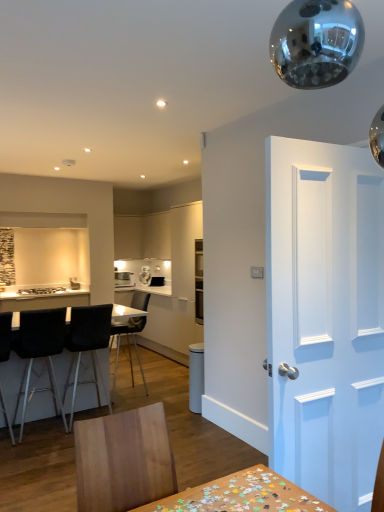
This screenshot has height=512, width=384. Describe the element at coordinates (145, 275) in the screenshot. I see `satin black toaster at center, which is counted as the 2th appliance, starting from the left` at that location.

The width and height of the screenshot is (384, 512). In order to click on white matte door at right in this screenshot , I will do `click(325, 317)`.

How much space does matte white cabinet at center, which is counted as the 1th cabinetry, starting from the left, occupy vertically?

The height of matte white cabinet at center, which is counted as the 1th cabinetry, starting from the left, is 79.75 centimeters.

What do you see at coordinates (128, 237) in the screenshot?
I see `matte white cabinet at center, which is counted as the 1th cabinetry, starting from the left` at bounding box center [128, 237].

Measure the distance between point (119, 280) and camera.

A distance of 6.86 meters exists between point (119, 280) and camera.

What is the approximate height of satin silver toaster at center, the second appliance in the right-to-left sequence?

satin silver toaster at center, the second appliance in the right-to-left sequence, is 9.98 inches in height.

The height and width of the screenshot is (512, 384). I want to click on white matte cabinet at center, which is counted as the first cabinetry, starting from the right, so click(156, 234).

Find the location of a particular element. The height and width of the screenshot is (512, 384). satin black toaster at center, which is counted as the 2th appliance, starting from the left is located at coordinates (145, 275).

From the image's perspective, which is above, satin black toaster at center, which is counted as the 2th appliance, starting from the left, or black leather chair at left, positioned as the 1th chair in front-to-back order?

satin black toaster at center, which is counted as the 2th appliance, starting from the left, from the image's perspective.

I want to click on the 3rd chair counting from the left of the satin black toaster at center, which is the 1th appliance from right to left, so click(5, 335).

Which object is wider, satin black toaster at center, which is the 1th appliance from right to left, or black leather chair at left, which is the 4th chair from back to front?

With larger width is black leather chair at left, which is the 4th chair from back to front.

Locate an element on the screen. the 2nd chair in front of the satin silver toaster at center, which is counted as the first appliance, starting from the left is located at coordinates (88, 345).

Who is more distant, black leather chair at left, acting as the second chair starting from the back, or satin silver toaster at center, the second appliance in the right-to-left sequence?

satin silver toaster at center, the second appliance in the right-to-left sequence.

Considering the relative positions of black leather chair at left, acting as the second chair starting from the back, and satin silver toaster at center, which is counted as the first appliance, starting from the left, in the image provided, is black leather chair at left, acting as the second chair starting from the back, to the left of satin silver toaster at center, which is counted as the first appliance, starting from the left, from the viewer's perspective?

No, black leather chair at left, acting as the second chair starting from the back, is not to the left of satin silver toaster at center, which is counted as the first appliance, starting from the left.

Is black fabric chair at left, the second chair in the front-to-back sequence, positioned with its back to white matte cabinet at center, which is counted as the first cabinetry, starting from the right?

That's not correct — black fabric chair at left, the second chair in the front-to-back sequence, is not looking away from white matte cabinet at center, which is counted as the first cabinetry, starting from the right.

From the picture: Considering the relative sizes of black fabric chair at left, the second chair in the front-to-back sequence, and white matte cabinet at center, marked as the second cabinetry in a left-to-right arrangement, in the image provided, is black fabric chair at left, the second chair in the front-to-back sequence, taller than white matte cabinet at center, marked as the second cabinetry in a left-to-right arrangement,?

Indeed, black fabric chair at left, the second chair in the front-to-back sequence, has a greater height compared to white matte cabinet at center, marked as the second cabinetry in a left-to-right arrangement.

From a real-world perspective, is black fabric chair at left, the second chair in the front-to-back sequence, positioned above or below white matte cabinet at center, marked as the second cabinetry in a left-to-right arrangement?

black fabric chair at left, the second chair in the front-to-back sequence, is situated lower than white matte cabinet at center, marked as the second cabinetry in a left-to-right arrangement, in the real world.

Which is more to the right, black fabric chair at left, acting as the 3th chair starting from the back, or white matte cabinet at center, marked as the second cabinetry in a left-to-right arrangement?

From the viewer's perspective, white matte cabinet at center, marked as the second cabinetry in a left-to-right arrangement, appears more on the right side.

From a real-world perspective, which object rests below the other?

In real-world perspective, black matte chair at center, which is the 1th chair from back to front, is lower.

Is there a large distance between black leather chair at left, positioned as the 1th chair in front-to-back order, and black matte chair at center, which is the 1th chair from back to front?

Yes, black leather chair at left, positioned as the 1th chair in front-to-back order, is far from black matte chair at center, which is the 1th chair from back to front.

Is black leather chair at left, which is the 4th chair from back to front, inside or outside of black matte chair at center, positioned as the fourth chair in front-to-back order?

black leather chair at left, which is the 4th chair from back to front, exists outside the volume of black matte chair at center, positioned as the fourth chair in front-to-back order.

Can you confirm if black leather chair at left, positioned as the 1th chair in front-to-back order, is bigger than black matte chair at center, positioned as the fourth chair in front-to-back order?

No.

Where is `cabinetry that is the 2nd object to the left of the white matte door at right, starting at the anchor`? The image size is (384, 512). cabinetry that is the 2nd object to the left of the white matte door at right, starting at the anchor is located at coordinates (128, 237).

From the image's perspective, between matte white cabinet at center, which is counted as the 1th cabinetry, starting from the left, and white matte door at right, which one is located above?

matte white cabinet at center, which is counted as the 1th cabinetry, starting from the left.

Considering the points (128, 253) and (297, 207), which point is behind, point (128, 253) or point (297, 207)?

Positioned behind is point (128, 253).

From a real-world perspective, which is physically above, white matte cabinet at center, which is counted as the first cabinetry, starting from the right, or matte white cabinet at center, the 2th cabinetry positioned from the right?

In real-world perspective, matte white cabinet at center, the 2th cabinetry positioned from the right, is above.

Is white matte cabinet at center, marked as the second cabinetry in a left-to-right arrangement, positioned far away from matte white cabinet at center, the 2th cabinetry positioned from the right?

They are positioned close to each other.

Based on the photo, considering the relative sizes of white matte cabinet at center, which is counted as the first cabinetry, starting from the right, and matte white cabinet at center, the 2th cabinetry positioned from the right, in the image provided, is white matte cabinet at center, which is counted as the first cabinetry, starting from the right, taller than matte white cabinet at center, the 2th cabinetry positioned from the right,?

Indeed, white matte cabinet at center, which is counted as the first cabinetry, starting from the right, has a greater height compared to matte white cabinet at center, the 2th cabinetry positioned from the right.

Is satin silver toaster at center, the second appliance in the right-to-left sequence, completely or partially outside of black leather chair at left, acting as the second chair starting from the back?

Indeed, satin silver toaster at center, the second appliance in the right-to-left sequence, is completely outside black leather chair at left, acting as the second chair starting from the back.

Can you confirm if satin silver toaster at center, the second appliance in the right-to-left sequence, is bigger than black leather chair at left, acting as the second chair starting from the back?

Actually, satin silver toaster at center, the second appliance in the right-to-left sequence, might be smaller than black leather chair at left, acting as the second chair starting from the back.

Between satin silver toaster at center, the second appliance in the right-to-left sequence, and black leather chair at left, acting as the second chair starting from the back, which one has more height?

black leather chair at left, acting as the second chair starting from the back, is taller.

Between satin silver toaster at center, the second appliance in the right-to-left sequence, and black leather chair at left, acting as the second chair starting from the back, which one is positioned behind?

satin silver toaster at center, the second appliance in the right-to-left sequence.

Locate an element on the screen. This screenshot has width=384, height=512. the 2nd appliance behind the black leather chair at left, which is the 4th chair from back to front, starting your count from the anchor is located at coordinates (145, 275).

Locate an element on the screen. This screenshot has height=512, width=384. appliance on the left of black leather chair at left, the 3th chair viewed from the front is located at coordinates (123, 279).

Which object lies nearer to the anchor point matte white cabinet at center, the 2th cabinetry positioned from the right, black fabric chair at left, the second chair in the front-to-back sequence, or satin black toaster at center, which is counted as the 2th appliance, starting from the left?

satin black toaster at center, which is counted as the 2th appliance, starting from the left.

Looking at the image, which one is located closer to white matte door at right, black leather chair at left, the 3th chair viewed from the front, or black leather chair at left, positioned as the 1th chair in front-to-back order?

black leather chair at left, the 3th chair viewed from the front, is positioned closer to the anchor white matte door at right.

Estimate the real-world distances between objects in this image. Which object is closer to matte white cabinet at center, which is counted as the 1th cabinetry, starting from the left, white matte door at right or black fabric chair at left, acting as the 3th chair starting from the back?

black fabric chair at left, acting as the 3th chair starting from the back, is positioned closer to the anchor matte white cabinet at center, which is counted as the 1th cabinetry, starting from the left.

When comparing their distances from black leather table at left, does white matte cabinet at center, marked as the second cabinetry in a left-to-right arrangement, or satin black toaster at center, which is counted as the 2th appliance, starting from the left, seem further?

white matte cabinet at center, marked as the second cabinetry in a left-to-right arrangement, lies further to black leather table at left than the other object.

Looking at the image, which one is located closer to white matte door at right, black leather chair at left, acting as the second chair starting from the back, or black leather table at left?

Among the two, black leather chair at left, acting as the second chair starting from the back, is located nearer to white matte door at right.

Which object lies nearer to the anchor point satin silver toaster at center, which is counted as the first appliance, starting from the left, black fabric chair at left, acting as the 3th chair starting from the back, or black leather table at left?

The object closer to satin silver toaster at center, which is counted as the first appliance, starting from the left, is black leather table at left.

Considering their positions, is satin silver toaster at center, the second appliance in the right-to-left sequence, positioned further to white matte cabinet at center, marked as the second cabinetry in a left-to-right arrangement, than white matte door at right?

Among the two, white matte door at right is located further to white matte cabinet at center, marked as the second cabinetry in a left-to-right arrangement.

When comparing their distances from black fabric chair at left, acting as the 3th chair starting from the back, does black leather table at left or white matte cabinet at center, which is counted as the first cabinetry, starting from the right, seem further?

Among the two, white matte cabinet at center, which is counted as the first cabinetry, starting from the right, is located further to black fabric chair at left, acting as the 3th chair starting from the back.

Where is `appliance located between black leather chair at left, acting as the second chair starting from the back, and matte white cabinet at center, the 2th cabinetry positioned from the right, in the depth direction`? appliance located between black leather chair at left, acting as the second chair starting from the back, and matte white cabinet at center, the 2th cabinetry positioned from the right, in the depth direction is located at coordinates (123, 279).

Where is `appliance between white matte door at right and matte white cabinet at center, the 2th cabinetry positioned from the right, in the front-back direction`? appliance between white matte door at right and matte white cabinet at center, the 2th cabinetry positioned from the right, in the front-back direction is located at coordinates tap(123, 279).

Where is `appliance between black matte chair at center, which is the 1th chair from back to front, and matte white cabinet at center, which is counted as the 1th cabinetry, starting from the left, along the z-axis`? The width and height of the screenshot is (384, 512). appliance between black matte chair at center, which is the 1th chair from back to front, and matte white cabinet at center, which is counted as the 1th cabinetry, starting from the left, along the z-axis is located at coordinates (123, 279).

Find the location of a particular element. The width and height of the screenshot is (384, 512). kitchen & dining room table located between white matte door at right and satin silver toaster at center, the second appliance in the right-to-left sequence, in the depth direction is located at coordinates (11, 380).